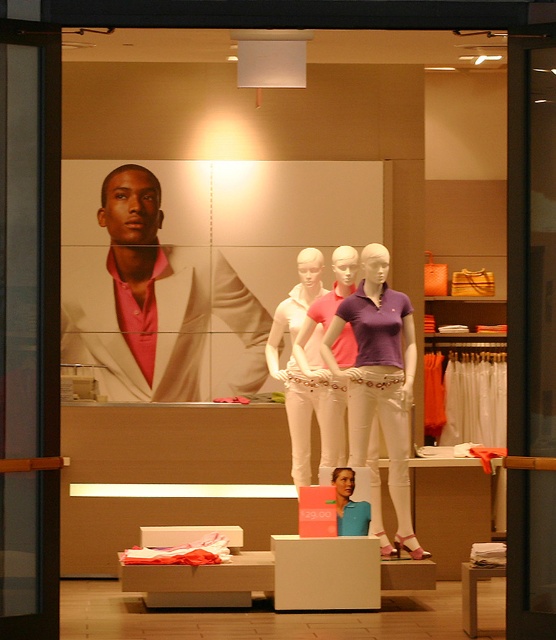
Question: Which point is closer to the camera?

Choices:
 (A) white matte pants at center
 (B) purple cotton polo shirt at center
 (C) matte green shirt at center

Answer: (C)

Question: Which object is closer to the camera taking this photo?

Choices:
 (A) matte white mannequin at center
 (B) matte green shirt at center

Answer: (B)

Question: Can you confirm if purple cotton polo shirt at center is positioned to the right of white matte pants at center?

Choices:
 (A) yes
 (B) no

Answer: (A)

Question: Is matte white suit at center bigger than purple cotton polo shirt at center?

Choices:
 (A) no
 (B) yes

Answer: (A)

Question: Observing the image, what is the correct spatial positioning of matte white mannequin at center in reference to matte green shirt at center?

Choices:
 (A) right
 (B) left

Answer: (B)

Question: Among these objects, which one is nearest to the camera?

Choices:
 (A) matte white suit at center
 (B) purple cotton polo shirt at center

Answer: (B)